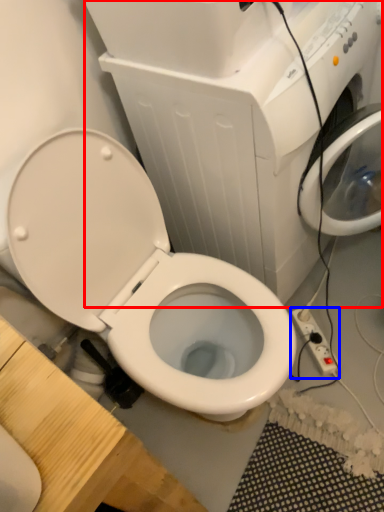
Question: Which object appears closest to the camera in this image, appliance (highlighted by a red box) or electric outlet (highlighted by a blue box)?

Choices:
 (A) appliance
 (B) electric outlet

Answer: (A)